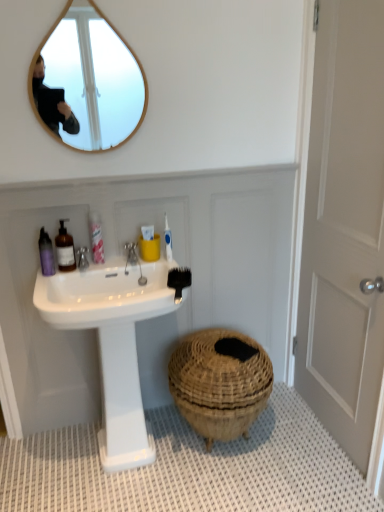
Image resolution: width=384 pixels, height=512 pixels. In order to click on free spot in front of brown woven basket at lower center in this screenshot , I will do `click(234, 488)`.